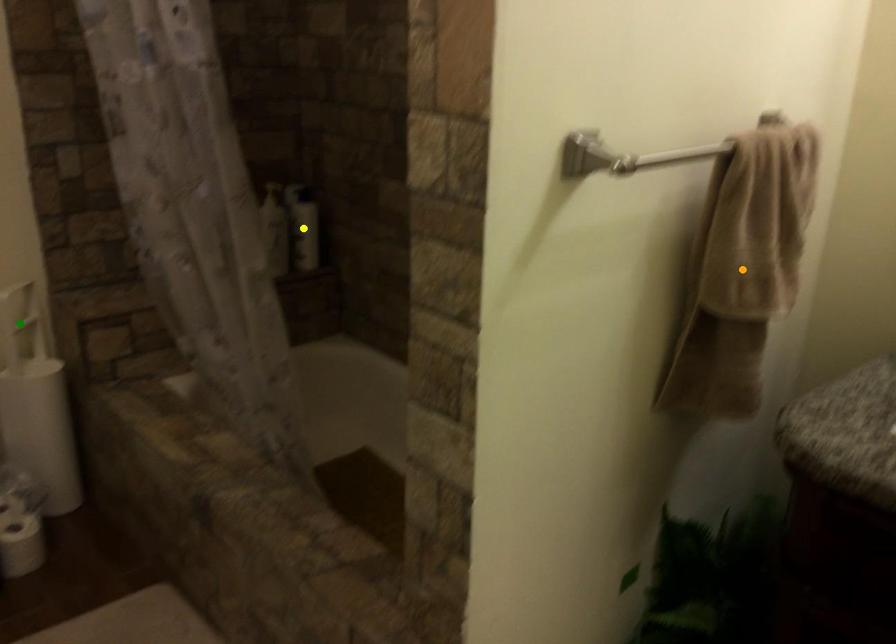
Looking at this image, order these from nearest to farthest:
yellow point, orange point, green point

orange point < green point < yellow point